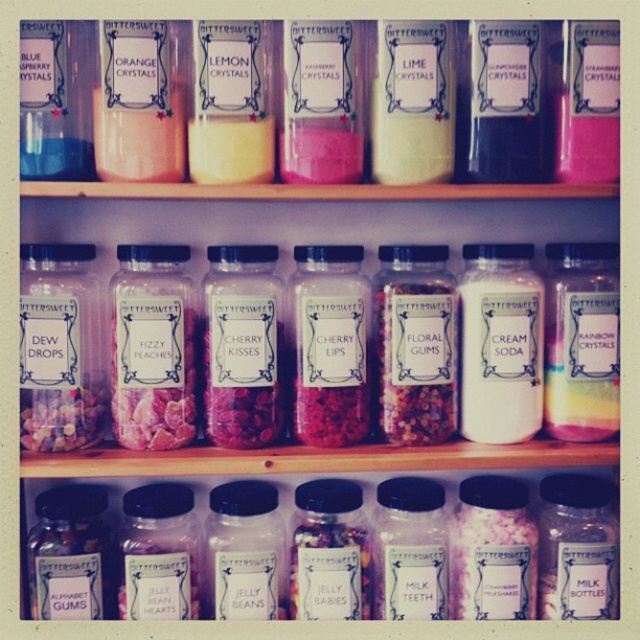
Who is shorter, white matte cream soda at center right or matte glass jar of cherry kisses at center?

matte glass jar of cherry kisses at center

In the scene shown: Is white matte cream soda at center right to the left of matte glass jar of cherry kisses at center from the viewer's perspective?

No, white matte cream soda at center right is not to the left of matte glass jar of cherry kisses at center.

Is point (468, 304) less distant than point (275, 308)?

No, (468, 304) is behind (275, 308).

At what (x,y) coordinates should I click in order to perform the action: click on white matte cream soda at center right. Please return your answer as a coordinate pair (x, y). Looking at the image, I should click on (500, 342).

Is orange crystals at center closer to camera compared to translucent plastic jelly beans at center?

That is True.

Is orange crystals at center above translucent plastic jelly beans at center?

Correct, orange crystals at center is located above translucent plastic jelly beans at center.

Find the location of a particular element. The height and width of the screenshot is (640, 640). orange crystals at center is located at coordinates (140, 100).

Does yellow crystals at center have a greater height compared to white matte lime crystals at center?

No, yellow crystals at center is not taller than white matte lime crystals at center.

Between yellow crystals at center and white matte lime crystals at center, which one is positioned higher?

white matte lime crystals at center is higher up.

Which is in front, point (246, 156) or point (444, 113)?

Positioned in front is point (246, 156).

The image size is (640, 640). Identify the location of yellow crystals at center. (230, 102).